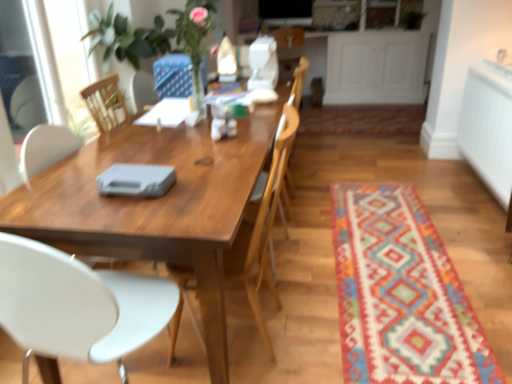
Question: From a real-world perspective, is multicolored woven mat at lower right, the first mat in the front-to-back sequence, beneath wooden chair at center, which is the first chair in right-to-left order?

Choices:
 (A) no
 (B) yes

Answer: (B)

Question: Does multicolored woven mat at lower right, the first mat in the front-to-back sequence, have a smaller size compared to wooden chair at center, acting as the 2th chair starting from the left?

Choices:
 (A) no
 (B) yes

Answer: (B)

Question: Can you confirm if multicolored woven mat at lower right, which ranks as the 2th mat in back-to-front order, is bigger than wooden chair at center, acting as the 2th chair starting from the left?

Choices:
 (A) no
 (B) yes

Answer: (A)

Question: Does multicolored woven mat at lower right, the first mat in the front-to-back sequence, turn towards wooden chair at center, acting as the 2th chair starting from the left?

Choices:
 (A) no
 (B) yes

Answer: (A)

Question: Can you confirm if multicolored woven mat at lower right, which ranks as the 2th mat in back-to-front order, is thinner than wooden chair at center, acting as the 2th chair starting from the left?

Choices:
 (A) no
 (B) yes

Answer: (A)

Question: From a real-world perspective, is multicolored woven mat at lower right, which ranks as the 2th mat in back-to-front order, positioned over wooden chair at center, acting as the 2th chair starting from the left, based on gravity?

Choices:
 (A) yes
 (B) no

Answer: (B)

Question: Can we say multicolored woven mat at lower right, the first mat in the front-to-back sequence, lies outside wooden table at center?

Choices:
 (A) yes
 (B) no

Answer: (A)

Question: Is multicolored woven mat at lower right, which ranks as the 2th mat in back-to-front order, surrounding wooden table at center?

Choices:
 (A) yes
 (B) no

Answer: (B)

Question: From a real-world perspective, is multicolored woven mat at lower right, arranged as the second mat when viewed from the top, on wooden table at center?

Choices:
 (A) no
 (B) yes

Answer: (A)

Question: From the image's perspective, would you say multicolored woven mat at lower right, which ranks as the 2th mat in back-to-front order, is positioned over wooden table at center?

Choices:
 (A) no
 (B) yes

Answer: (A)

Question: Is the depth of multicolored woven mat at lower right, the first mat in the front-to-back sequence, greater than that of wooden table at center?

Choices:
 (A) yes
 (B) no

Answer: (A)

Question: Is multicolored woven mat at lower right, the first mat positioned from the bottom, positioned far away from wooden table at center?

Choices:
 (A) no
 (B) yes

Answer: (A)

Question: Is blue fabric armchair at upper center, the 1th armchair viewed from the left, at the right side of multicolored woven rug at center, which is the first mat in back-to-front order?

Choices:
 (A) no
 (B) yes

Answer: (A)